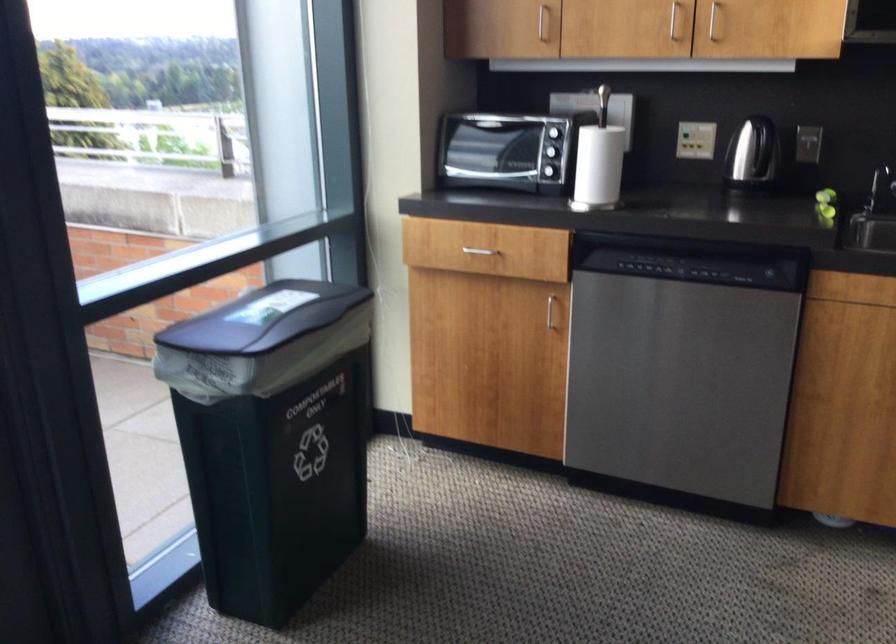
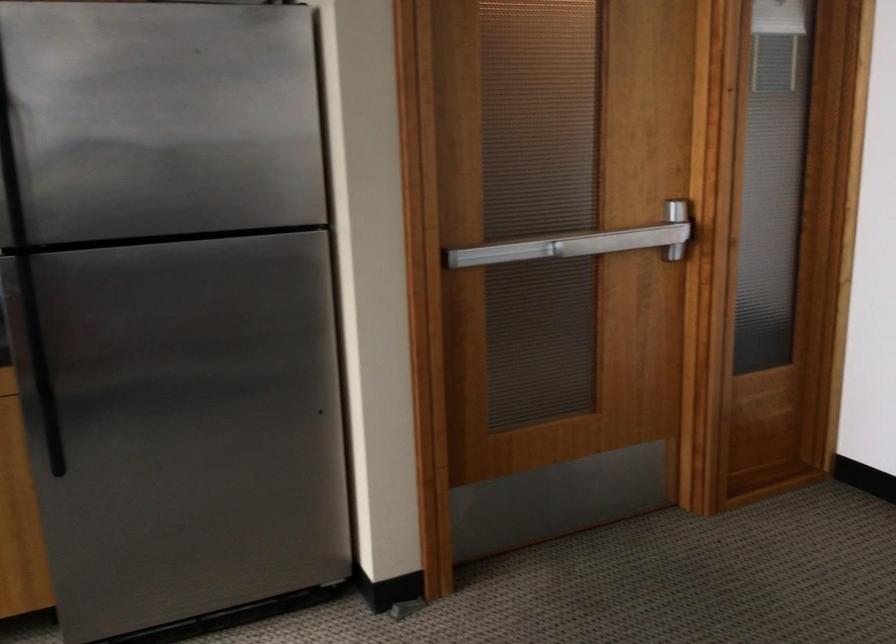
Question: Based on the continuous images, in which direction is the camera rotating? Reply with the corresponding letter.

Choices:
 (A) Left
 (B) Right
 (C) Up
 (D) Down

Answer: (B)